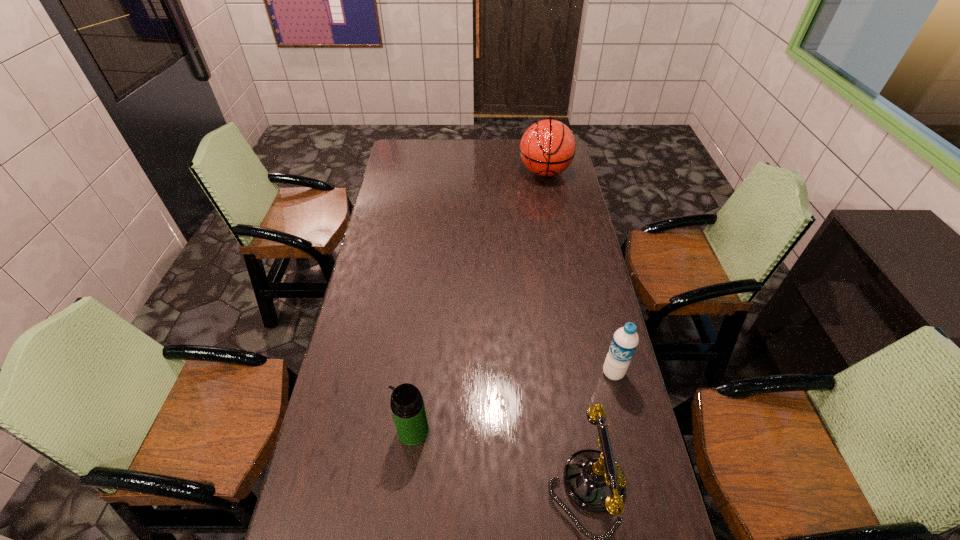
I want to click on vacant space on the desktop that is between the thermos bottle and the shortest object and is positioned on the side with spill of the farthest object, so click(484, 453).

Find the location of a particular element. Image resolution: width=960 pixels, height=540 pixels. free space on the desktop that is between the thermos bottle and the telephone and is positioned on the label of the third nearest object is located at coordinates (478, 451).